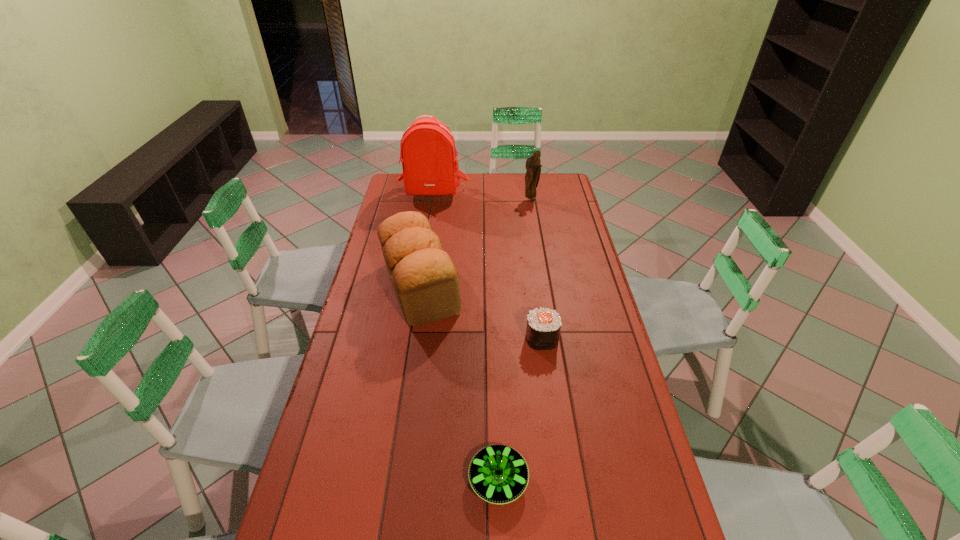
This screenshot has height=540, width=960. What are the coordinates of `free space located 0.280m on the back of the nearest object` in the screenshot? It's located at (494, 368).

Locate an element on the screen. The height and width of the screenshot is (540, 960). object that is at the far edge is located at coordinates (428, 150).

I want to click on backpack located at the left edge, so click(x=428, y=150).

The image size is (960, 540). Identify the location of bread at the left edge. (424, 278).

You are a GUI agent. You are given a task and a screenshot of the screen. Output one action in this format:
    pyautogui.click(x=<x>, y=<y>)
    Task: Click on the object that is at the far left corner
    
    Given the screenshot: What is the action you would take?
    pyautogui.click(x=428, y=150)

In the image, there is a desktop. Identify the location of vacant area at the left edge. Image resolution: width=960 pixels, height=540 pixels. (376, 303).

The width and height of the screenshot is (960, 540). What are the coordinates of `free space at the right edge of the desktop` in the screenshot? It's located at (582, 235).

Identify the location of vacant region at the far right corner of the desktop. click(565, 196).

Locate an element on the screen. vacant region between the third object from right to left and the fourth tallest object is located at coordinates (520, 409).

Where is `unoccupied position between the backpack and the figurine`? unoccupied position between the backpack and the figurine is located at coordinates (482, 197).